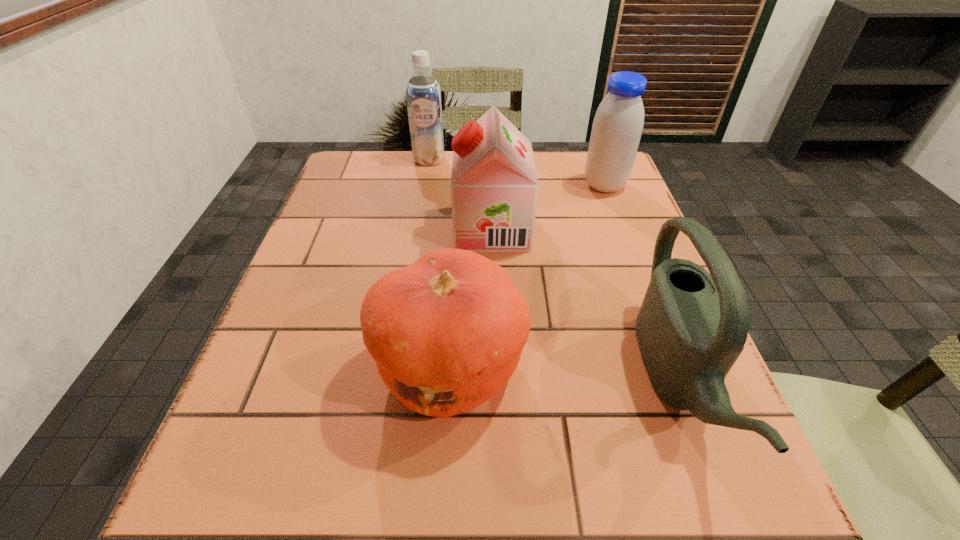
This screenshot has height=540, width=960. Identify the location of object that is positioned at the far right corner. (618, 123).

At what (x,y) coordinates should I click in order to perform the action: click on object located in the near right corner section of the desktop. Please return your answer as a coordinate pair (x, y). The height and width of the screenshot is (540, 960). Looking at the image, I should click on (692, 326).

The image size is (960, 540). I want to click on vacant region at the far edge, so click(x=421, y=177).

I want to click on free space at the near edge of the desktop, so click(x=588, y=517).

This screenshot has width=960, height=540. What are the coordinates of `blank area at the left edge` in the screenshot? It's located at (357, 218).

In the image, there is a desktop. Identify the location of vacant space at the right edge. Image resolution: width=960 pixels, height=540 pixels. (628, 254).

Where is `vacant space at the far left corner of the desktop`? The image size is (960, 540). vacant space at the far left corner of the desktop is located at coordinates (362, 153).

Locate an element on the screen. The height and width of the screenshot is (540, 960). vacant region at the near left corner of the desktop is located at coordinates (233, 502).

Locate an element on the screen. free space between the watering can and the fourth nearest object is located at coordinates (640, 283).

The width and height of the screenshot is (960, 540). Identify the location of empty location between the nearest soya milk and the watering can. (585, 304).